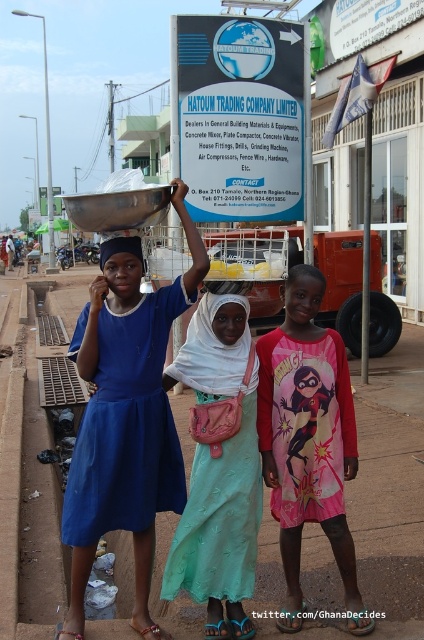
Question: Does pink cotton dress at center have a greater width compared to matte blue headscarf at center?

Choices:
 (A) no
 (B) yes

Answer: (B)

Question: Which of the following is the farthest from the observer?

Choices:
 (A) pink cotton dress at center
 (B) matte blue dress at left

Answer: (A)

Question: Which point appears farthest from the camera in this image?

Choices:
 (A) (103, 486)
 (B) (103, 266)
 (C) (231, 474)
 (D) (310, 298)

Answer: (D)

Question: Does matte blue dress at left have a lesser width compared to pink cotton dress at center?

Choices:
 (A) yes
 (B) no

Answer: (B)

Question: Which point is farther to the camera?

Choices:
 (A) (290, 278)
 (B) (198, 314)
 (C) (109, 342)

Answer: (A)

Question: Does pink fabric purse at center have a greater width compared to pink fabric headscarf at center?

Choices:
 (A) no
 (B) yes

Answer: (B)